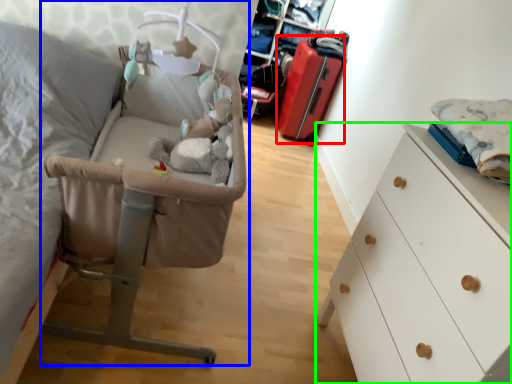
Question: Estimate the real-world distances between objects in this image. Which object is closer to luggage (highlighted by a red box), infant bed (highlighted by a blue box) or chest of drawers (highlighted by a green box)?

Choices:
 (A) infant bed
 (B) chest of drawers

Answer: (A)